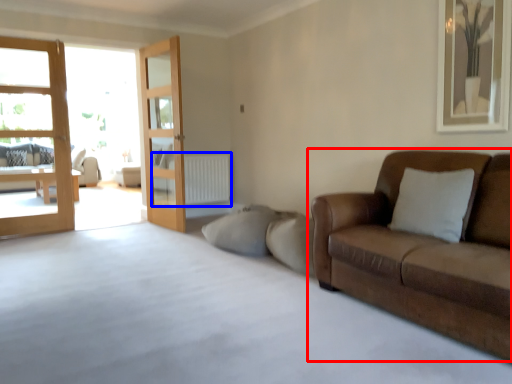
Question: Among these objects, which one is farthest to the camera, studio couch (highlighted by a red box) or radiator (highlighted by a blue box)?

Choices:
 (A) studio couch
 (B) radiator

Answer: (B)